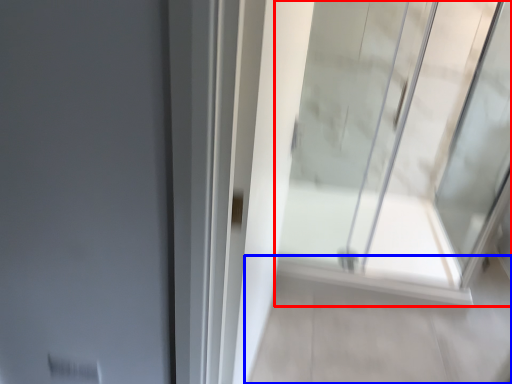
Question: Which object is further to the camera taking this photo, window (highlighted by a red box) or path (highlighted by a blue box)?

Choices:
 (A) window
 (B) path

Answer: (B)